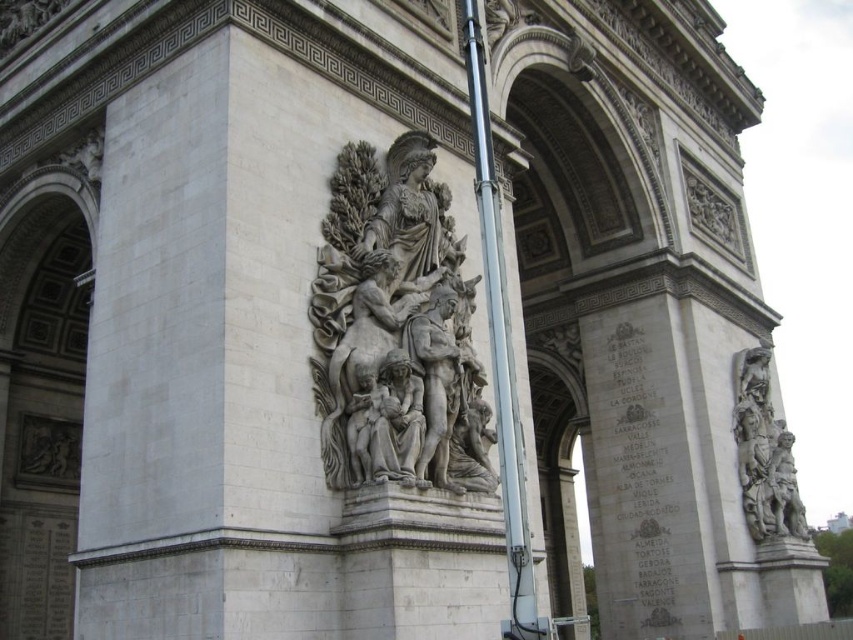
Question: Is white marble sculpture at center positioned in front of gray stone sculpture at right?

Choices:
 (A) no
 (B) yes

Answer: (B)

Question: Which object appears farthest from the camera in this image?

Choices:
 (A) gray stone sculpture at right
 (B) white marble sculpture at center
 (C) metallic silver pole at center

Answer: (A)

Question: Is metallic silver pole at center closer to camera compared to gray stone sculpture at right?

Choices:
 (A) yes
 (B) no

Answer: (A)

Question: Does metallic silver pole at center appear on the right side of gray stone sculpture at right?

Choices:
 (A) no
 (B) yes

Answer: (A)

Question: Which of these objects is positioned closest to the white marble sculpture at center?

Choices:
 (A) gray stone sculpture at right
 (B) metallic silver pole at center

Answer: (B)

Question: Considering the real-world distances, which object is closest to the white marble sculpture at center?

Choices:
 (A) metallic silver pole at center
 (B) gray stone sculpture at right

Answer: (A)